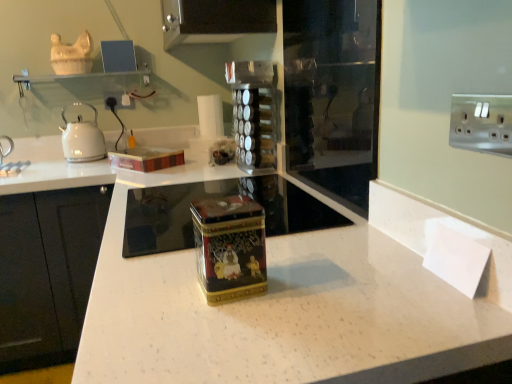
What are the coordinates of `free space in front of white glossy kettle at left` in the screenshot? It's located at (76, 165).